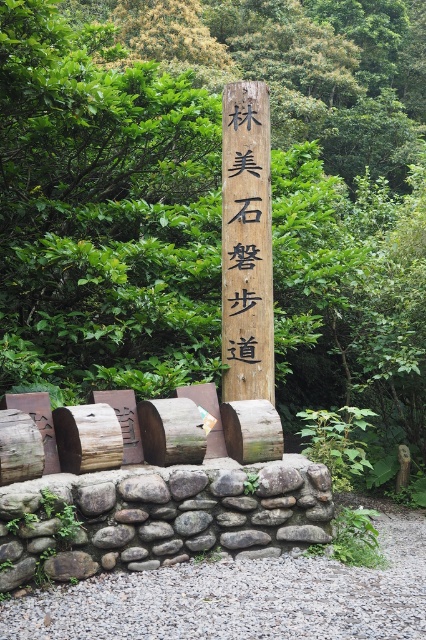
Is gray rough stone wall at lower center below wooden signpost at center?

Yes, gray rough stone wall at lower center is below wooden signpost at center.

Which is more to the right, gray rough stone wall at lower center or wooden signpost at center?

Positioned to the right is wooden signpost at center.

What do you see at coordinates (161, 515) in the screenshot?
I see `gray rough stone wall at lower center` at bounding box center [161, 515].

The height and width of the screenshot is (640, 426). Find the location of `gray rough stone wall at lower center`. gray rough stone wall at lower center is located at coordinates (161, 515).